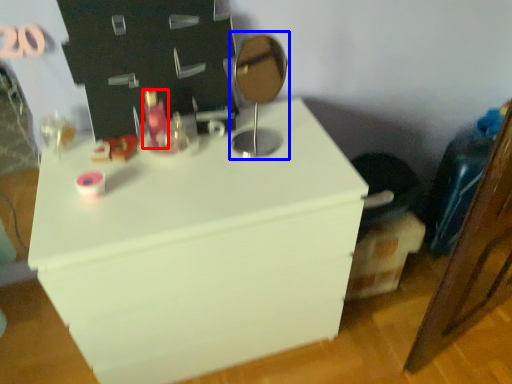
Question: Which object is further to the camera taking this photo, toiletry (highlighted by a red box) or table lamp (highlighted by a blue box)?

Choices:
 (A) toiletry
 (B) table lamp

Answer: (A)